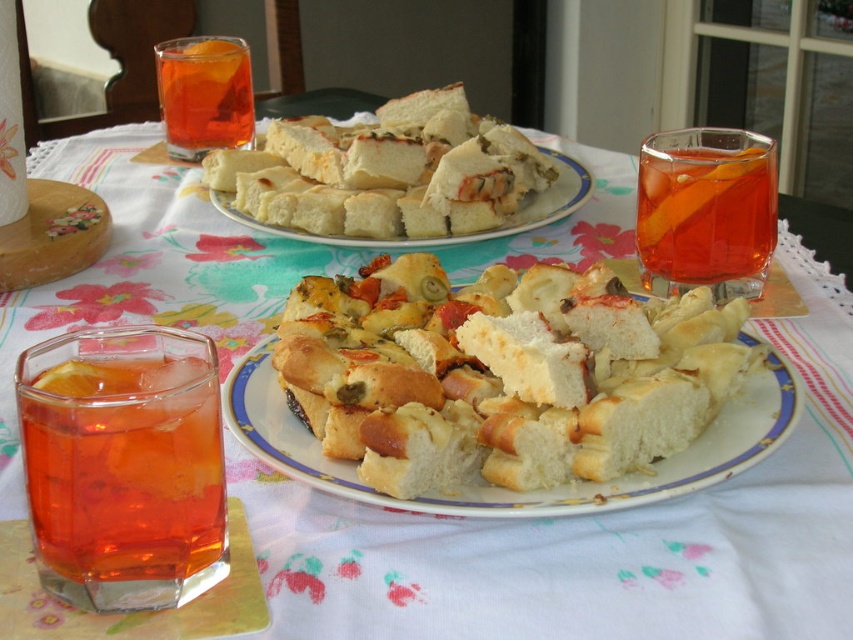
You are at a table with two plates of food and glasses of a red beverage. You want to reach for the plate closest to you. Which plate should you choose between the plate in the foreground and the plate at point (x=167, y=504)?

The plate at point (x=167, y=504) is 10.09 inches away from the camera, so the plate in the foreground is closer to you and should be chosen.

You are sitting at the table and want to reach for a drink. There are two points on the tablecloth where the glasses are placed. One is at point (648, 412) and the other at point (764, 179). Which point is closer to you?

Point (648, 412) is in front of point (764, 179), so the glass at point (648, 412) is closer to you.

You are a guest at a dinner table with a floral tablecloth and two plates. You want to reach for the golden crusty bread at center without disturbing the other items on the table. Based on its position, which direction should you move your hand from the edge of the table to safely grab it?

The golden crusty bread at center is located at point coordinates, so you should move your hand towards the center of the table from the edge to safely grab it.